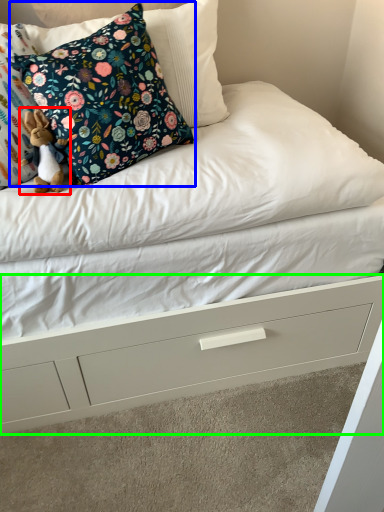
Question: Which object is the closest to the toy (highlighted by a red box)? Choose among these: pillow (highlighted by a blue box) or drawer (highlighted by a green box).

Choices:
 (A) pillow
 (B) drawer

Answer: (A)